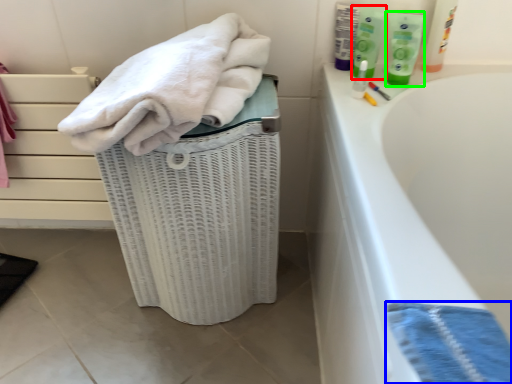
Question: Which is nearer to the cleaning product (highlighted by a red box)? bath towel (highlighted by a blue box) or toiletry (highlighted by a green box).

Choices:
 (A) bath towel
 (B) toiletry

Answer: (B)